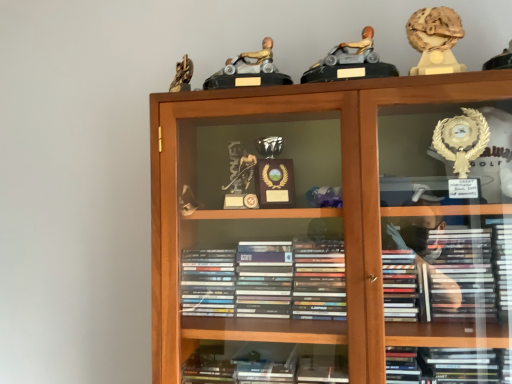
Question: In terms of size, does gold metallic figure at upper center, which is counted as the 1th toy, starting from the left, appear bigger or smaller than wooden bookcase at center?

Choices:
 (A) small
 (B) big

Answer: (A)

Question: Is gold metallic figure at upper center, which is counted as the 1th toy, starting from the left, to the left or to the right of wooden bookcase at center in the image?

Choices:
 (A) right
 (B) left

Answer: (B)

Question: Which object is the farthest from the gold marble statue at upper right, acting as the 3th toy starting from the left?

Choices:
 (A) gold metallic figure at upper center, placed as the 3th toy when sorted from right to left
 (B) matte gray plastic toy car at upper center, the second toy in the left-to-right sequence
 (C) wooden bookcase at center

Answer: (C)

Question: Which is nearer to the wooden bookcase at center?

Choices:
 (A) gold metallic figure at upper center, placed as the 3th toy when sorted from right to left
 (B) gold marble statue at upper right, which is counted as the 1th toy, starting from the right
 (C) matte gray plastic toy car at upper center, the second toy positioned from the right

Answer: (A)